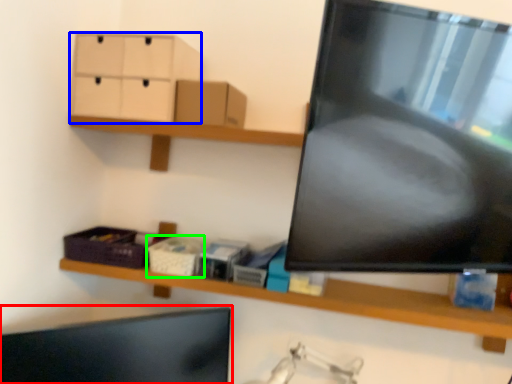
Question: Which object is positioned farthest from computer monitor (highlighted by a red box)? Select from drawer (highlighted by a blue box) and storage box (highlighted by a green box).

Choices:
 (A) drawer
 (B) storage box

Answer: (A)